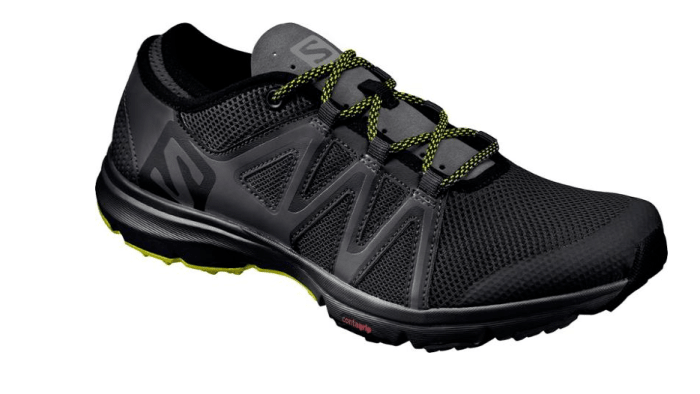
This screenshot has height=394, width=700. I want to click on lace, so click(343, 102).